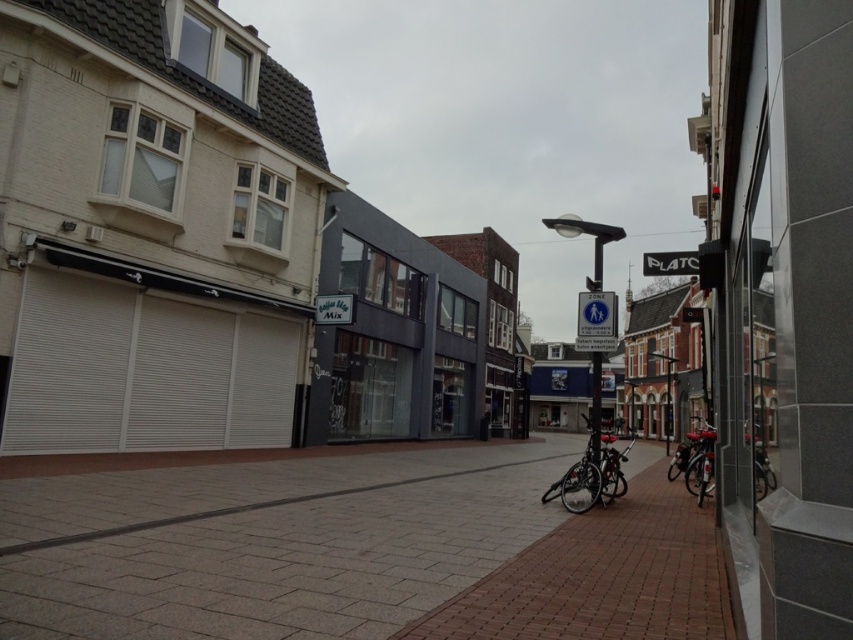
Question: Which point is farther to the camera?

Choices:
 (A) (239, 496)
 (B) (569, 216)

Answer: (B)

Question: Which point appears closest to the camera in this image?

Choices:
 (A) (554, 227)
 (B) (322, 632)
 (C) (583, 476)

Answer: (B)

Question: Which point is closer to the camera?

Choices:
 (A) (596, 369)
 (B) (338, 509)

Answer: (B)

Question: Can you confirm if brick pavement at center is positioned below shiny metallic bicycle at center?

Choices:
 (A) no
 (B) yes

Answer: (A)

Question: Is shiny metallic bicycle at center closer to the viewer compared to white plastic sign at center?

Choices:
 (A) yes
 (B) no

Answer: (A)

Question: Is brick pavement at center thinner than white plastic sign at center?

Choices:
 (A) yes
 (B) no

Answer: (A)